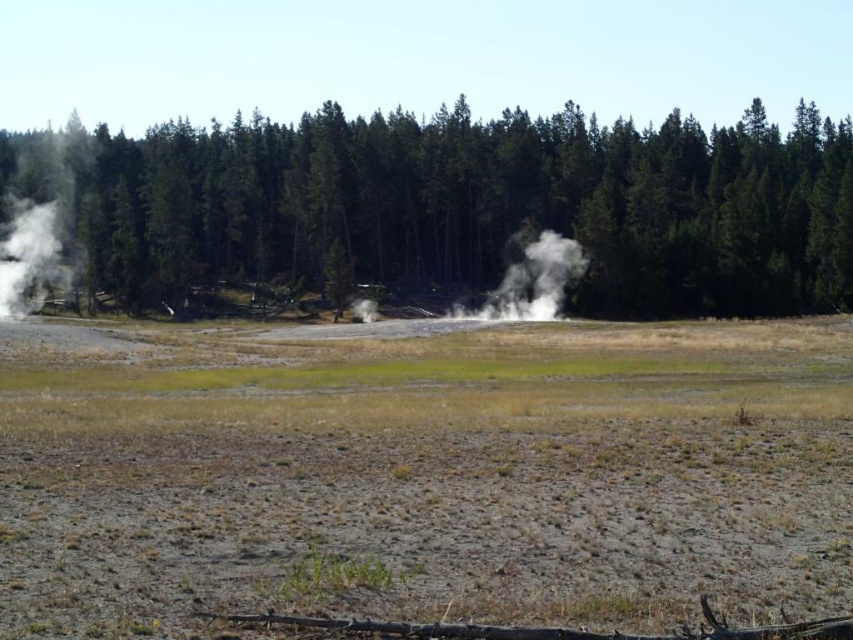
You are a park ranger exploring the geothermal area. You need to locate the green matte trees at center. According to the map, there is a point marked at coordinates (477, 208). Where should you go to find the green matte trees at center?

The point marked at coordinates (477, 208) indicates the location of the green matte trees at center, so you should go to that coordinate to find them.

You are a hiker planning to take a photo of the green matte trees at center from your current position. If your camera has a maximum focus range of 100 meters, will you need to move closer to the trees to capture a clear photo?

The green matte trees at center are 104.80 meters away from the viewer. Since the camera can only focus up to 100 meters, you need to move closer to ensure the trees are within the focus range.

You are a hiker navigating through this geothermal area. You notice two points marked on your map at coordinates point (22, 531) and point (552, 316). Which point is closer to you as you stand at the starting point of the trail?

Point (22, 531) is in front of point (552, 316), so it is closer to you as you stand at the starting point of the trail.